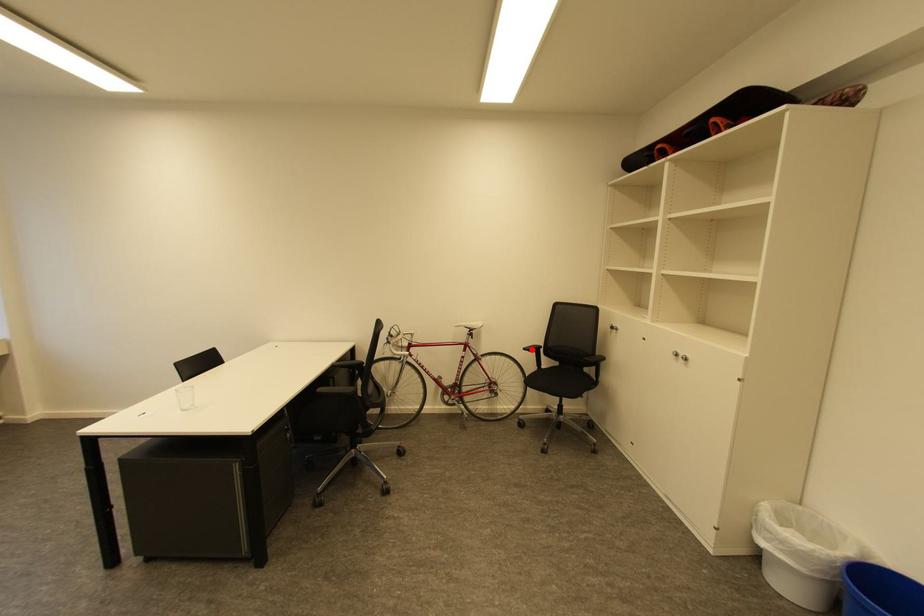
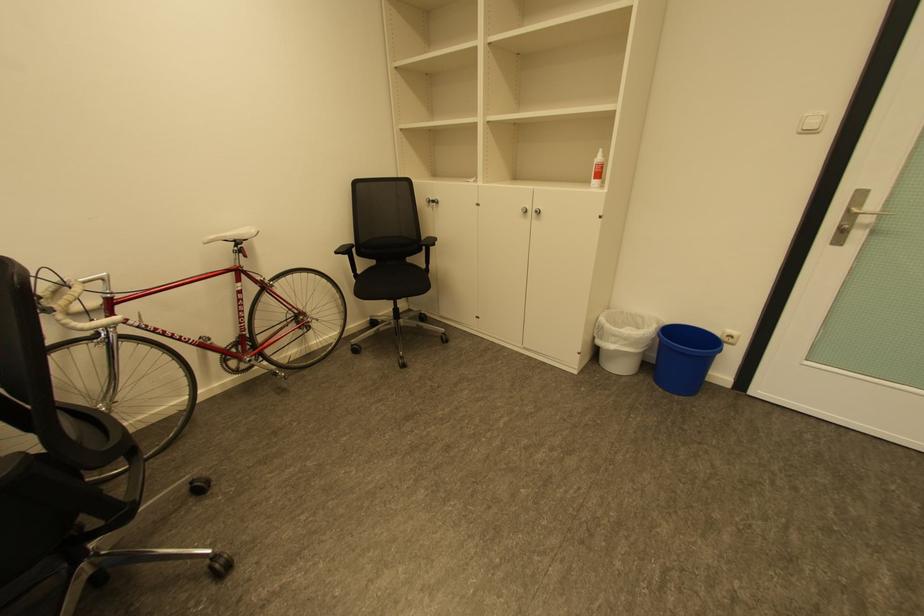
Question: I am providing you with two images of the same scene from different viewpoints. Given a red point in image1, look at the same physical point in image2. Is it:

Choices:
 (A) Closer to the viewpoint
 (B) Farther from the viewpoint

Answer: (A)